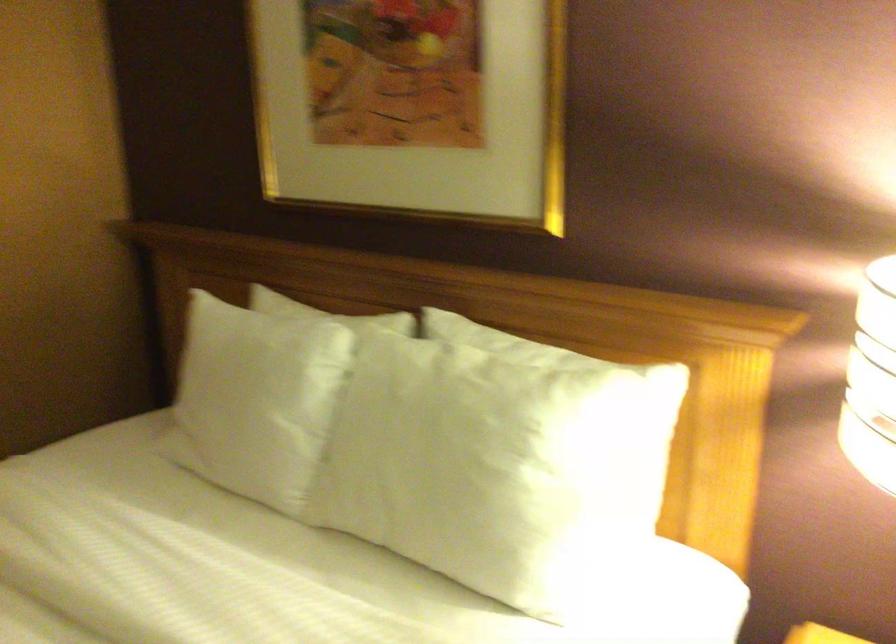
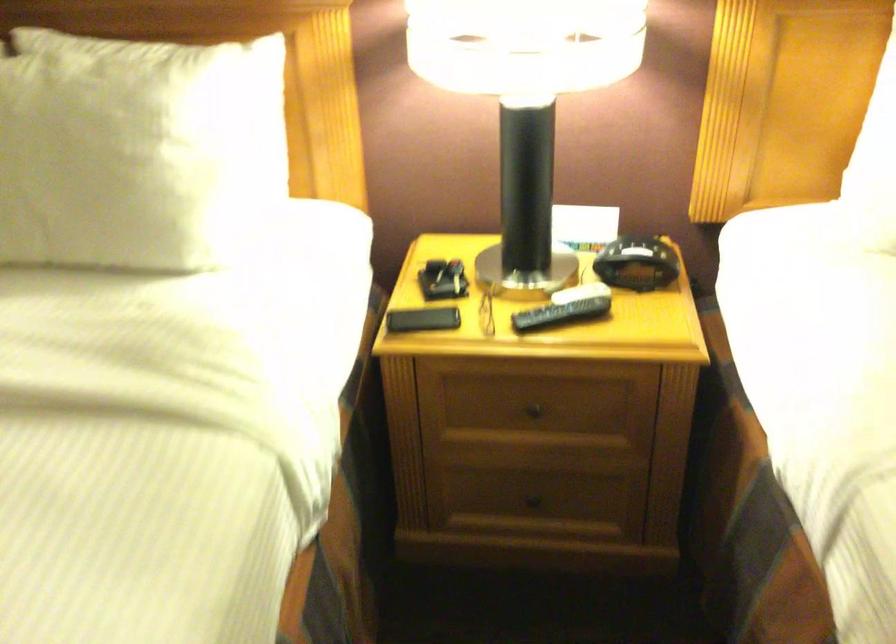
Where in the second image is the point corresponding to (x=495, y=460) from the first image?

(134, 149)